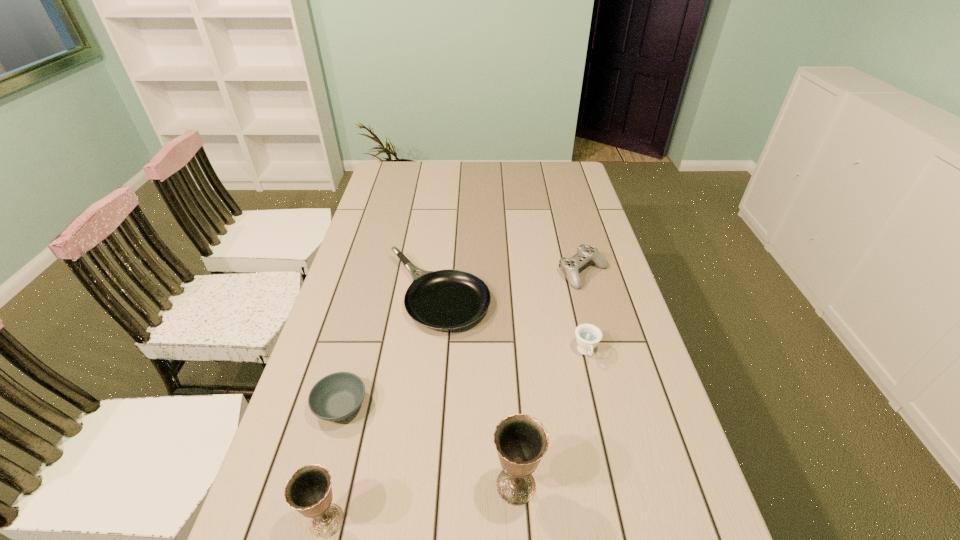
Image resolution: width=960 pixels, height=540 pixels. In the image, there is a desktop. What are the coordinates of `vacant space at the far left corner` in the screenshot? It's located at (404, 177).

You are a GUI agent. You are given a task and a screenshot of the screen. Output one action in this format:
    pyautogui.click(x=<x>, y=<y>)
    Task: Click on the vacant area that lies between the right chalice and the teacup
    This screenshot has width=960, height=540.
    Given the screenshot: What is the action you would take?
    pyautogui.click(x=551, y=418)

I want to click on blank region between the soup bowl and the pan, so click(390, 350).

This screenshot has height=540, width=960. Find the location of `free space between the shortest object and the control`. free space between the shortest object and the control is located at coordinates (462, 340).

At what (x,y) coordinates should I click in order to perform the action: click on free point between the control and the pan. Please return your answer as a coordinate pair (x, y). Looking at the image, I should click on (511, 284).

Where is `vacant space in between the taller chalice and the soup bowl`? The image size is (960, 540). vacant space in between the taller chalice and the soup bowl is located at coordinates (428, 446).

The image size is (960, 540). Identify the location of vacant area that lies between the pan and the shortest object. (390, 350).

Where is `free point between the pan and the control`? The image size is (960, 540). free point between the pan and the control is located at coordinates (511, 284).

Identify the location of vacant area that lies between the pan and the taller chalice. The width and height of the screenshot is (960, 540). (477, 390).

In order to click on free space between the teacup and the control in this screenshot , I will do `click(585, 313)`.